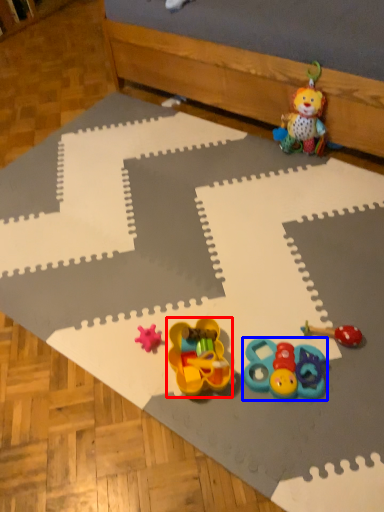
Question: Which point is closer to the camera, toy (highlighted by a red box) or toy (highlighted by a blue box)?

Choices:
 (A) toy
 (B) toy

Answer: (A)